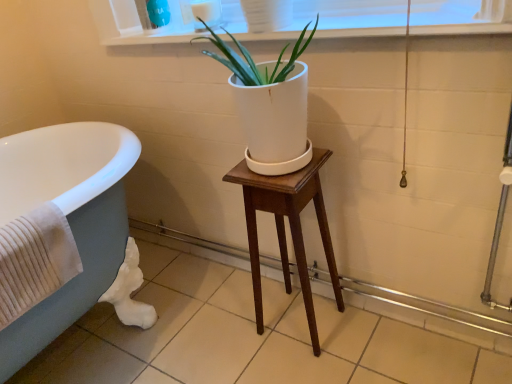
Question: Looking at the image, does matte gray tub at left seem bigger or smaller compared to mahogany wood stool at center?

Choices:
 (A) big
 (B) small

Answer: (A)

Question: Is point (65, 205) positioned closer to the camera than point (286, 261)?

Choices:
 (A) farther
 (B) closer

Answer: (B)

Question: Estimate the real-world distances between objects in this image. Which object is closer to the mahogany wood stool at center?

Choices:
 (A) matte gray tub at left
 (B) white glossy window sill at upper center
 (C) white matte pot at center

Answer: (C)

Question: Which object is positioned closest to the matte gray tub at left?

Choices:
 (A) mahogany wood stool at center
 (B) white glossy window sill at upper center
 (C) white matte pot at center

Answer: (C)